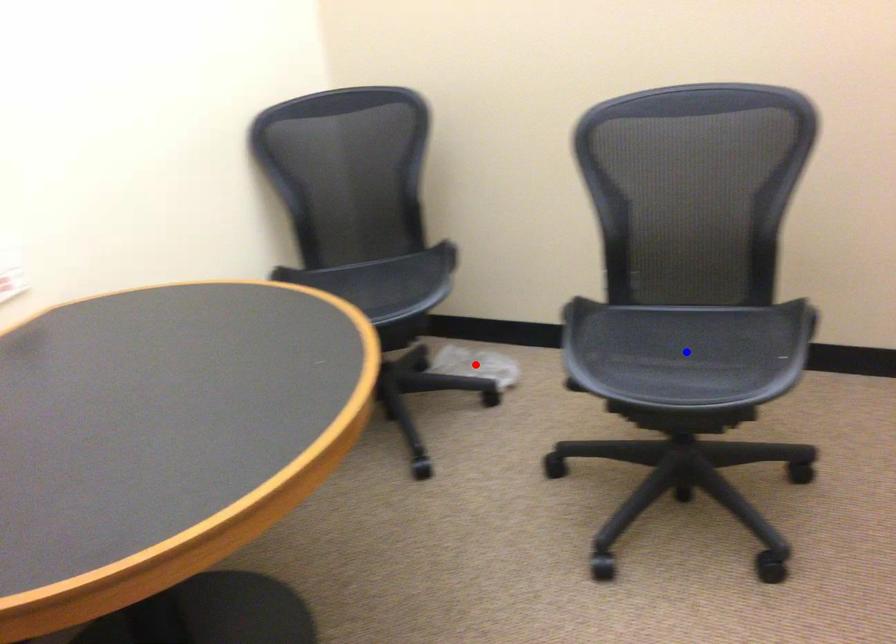
Question: Which of the two points in the image is closer to the camera?

Choices:
 (A) Blue point is closer.
 (B) Red point is closer.

Answer: (A)